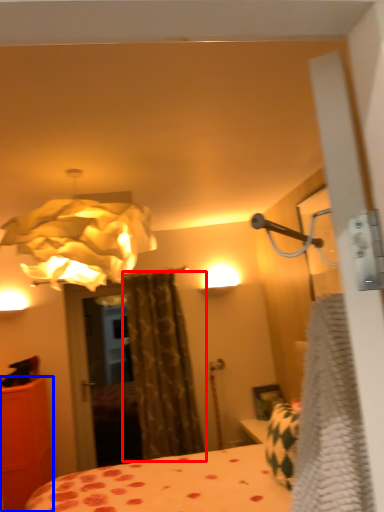
Question: Among these objects, which one is nearest to the camera, curtain (highlighted by a red box) or furniture (highlighted by a blue box)?

Choices:
 (A) curtain
 (B) furniture

Answer: (B)